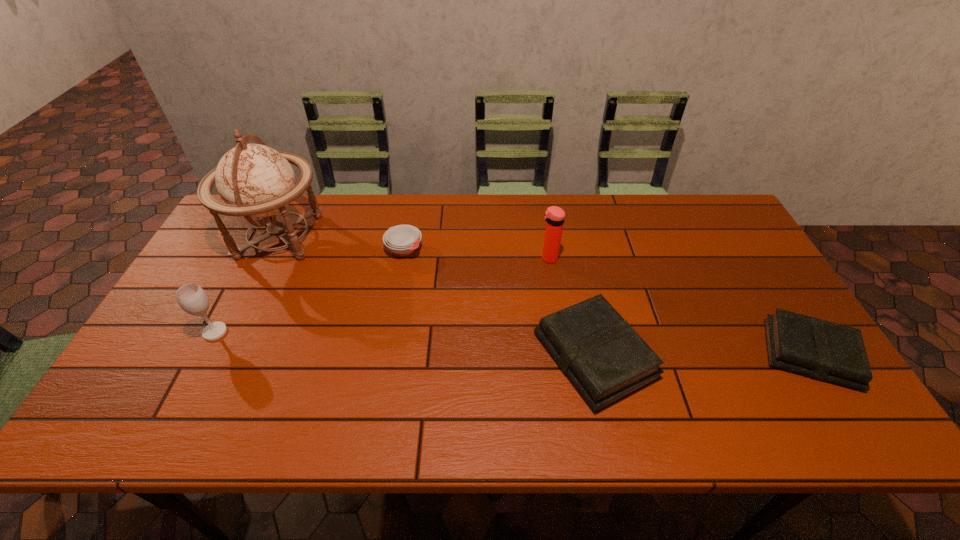
Find the location of a particular element. Image resolution: width=960 pixels, height=540 pixels. vacant region located 0.160m on the left of the soup bowl is located at coordinates (334, 249).

Where is `vacant space located 0.200m on the back of the fourth shortest object`? The height and width of the screenshot is (540, 960). vacant space located 0.200m on the back of the fourth shortest object is located at coordinates (248, 269).

The height and width of the screenshot is (540, 960). I want to click on vacant area situated at the front of the globe showing Africa, so click(391, 237).

This screenshot has width=960, height=540. I want to click on free space located on the right of the thermos bottle, so (689, 259).

Locate an element on the screen. The width and height of the screenshot is (960, 540). soup bowl at the far edge is located at coordinates click(402, 239).

I want to click on globe that is at the far edge, so (x=254, y=180).

The width and height of the screenshot is (960, 540). What are the coordinates of `wineglass situated at the left edge` in the screenshot? It's located at (192, 298).

You are a GUI agent. You are given a task and a screenshot of the screen. Output one action in this format:
    pyautogui.click(x=<x>, y=<y>)
    Task: Click on the globe at the left edge
    The width and height of the screenshot is (960, 540).
    Given the screenshot: What is the action you would take?
    pyautogui.click(x=254, y=180)

This screenshot has height=540, width=960. What are the coordinates of `object at the right edge` in the screenshot? It's located at (818, 349).

This screenshot has width=960, height=540. Identify the location of object present at the far left corner. (254, 180).